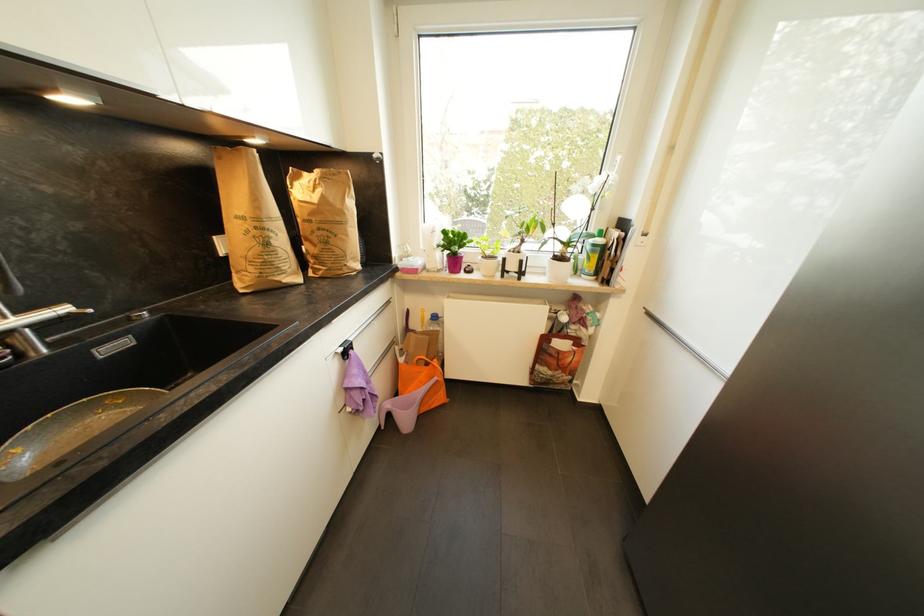
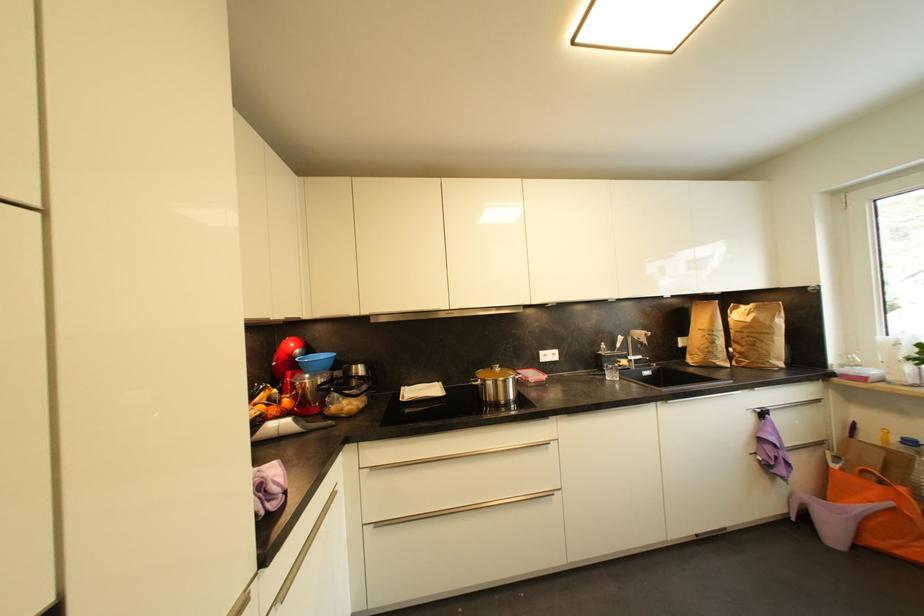
Question: I am providing you with two images of the same scene from different viewpoints. After the viewpoint changes to image2, which objects are now occluded?

Choices:
 (A) purple plastic object
 (B) pot lid handle
 (C) brown paper bag
 (D) none of these

Answer: (D)